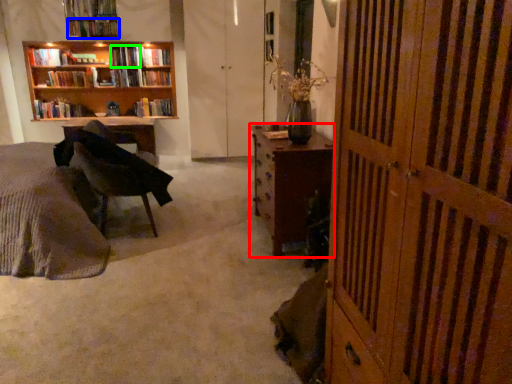
Question: Which object is positioned closest to desk (highlighted by a red box)? Select from book (highlighted by a blue box) and book (highlighted by a green box).

Choices:
 (A) book
 (B) book

Answer: (B)